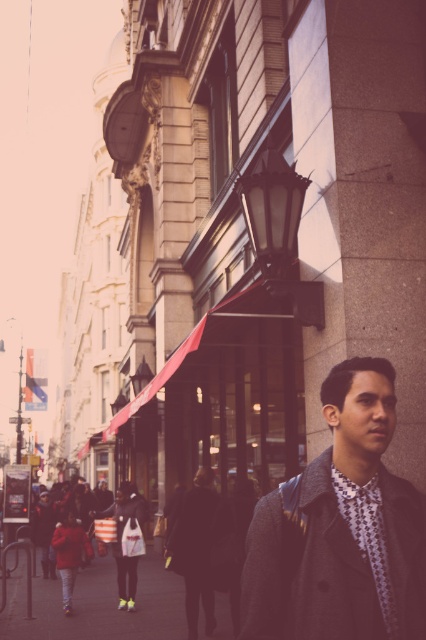
You are a pedestrian standing on the sidewalk and see both the dark gray woolen jacket at lower right and the dark gray wool coat at center. Which one is higher up in the image?

The dark gray woolen jacket at lower right is above the dark gray wool coat at center, so it is higher up in the image.

You are a tailor who needs to determine which garment requires more fabric for alterations. Based on the image, which of the two dark gray wool items, the dark gray woolen jacket at lower right or the dark gray wool coat at center, has a larger size?

The dark gray wool coat at center requires more fabric because it has a greater width than the dark gray woolen jacket at lower right.

You are standing at the center of the street and see the dark gray woolen jacket at lower right and the dark gray wool coat at center. Which one is closer to you?

The dark gray wool coat at center is closer to you since it is at the center of the scene, while the dark gray woolen jacket at lower right is farther away at 65.57 feet.